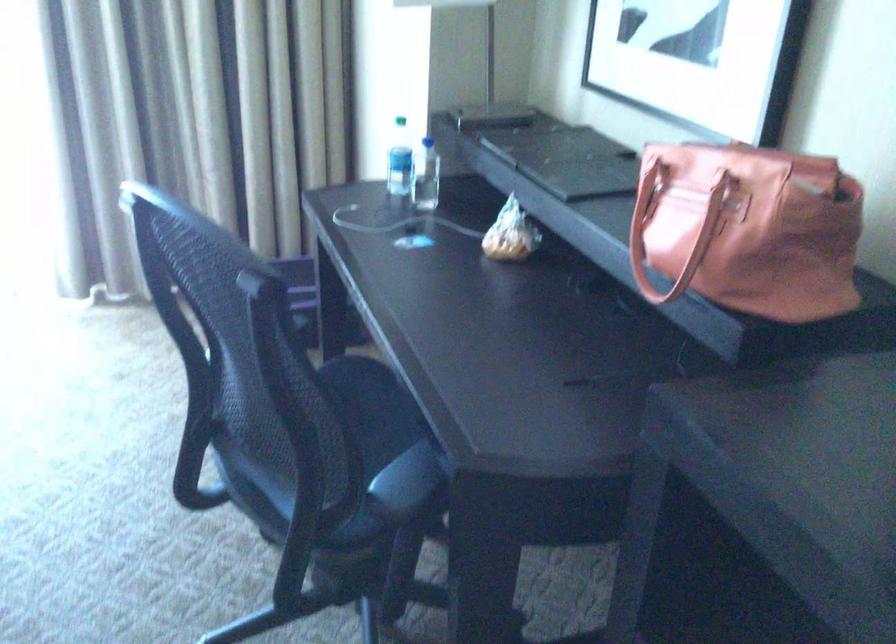
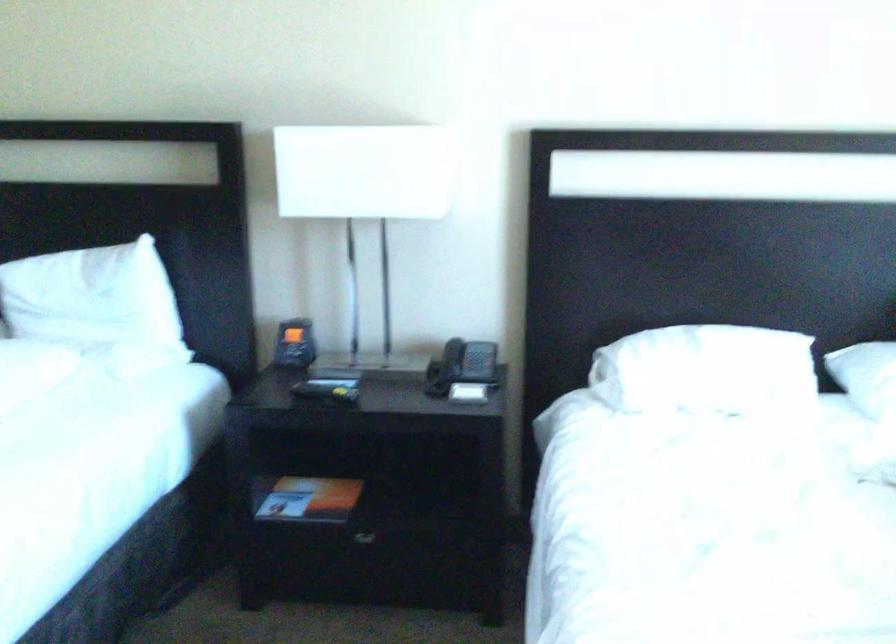
The first image is from the beginning of the video and the second image is from the end. How did the camera likely rotate when shooting the video?

The camera's rotation is toward left-down.